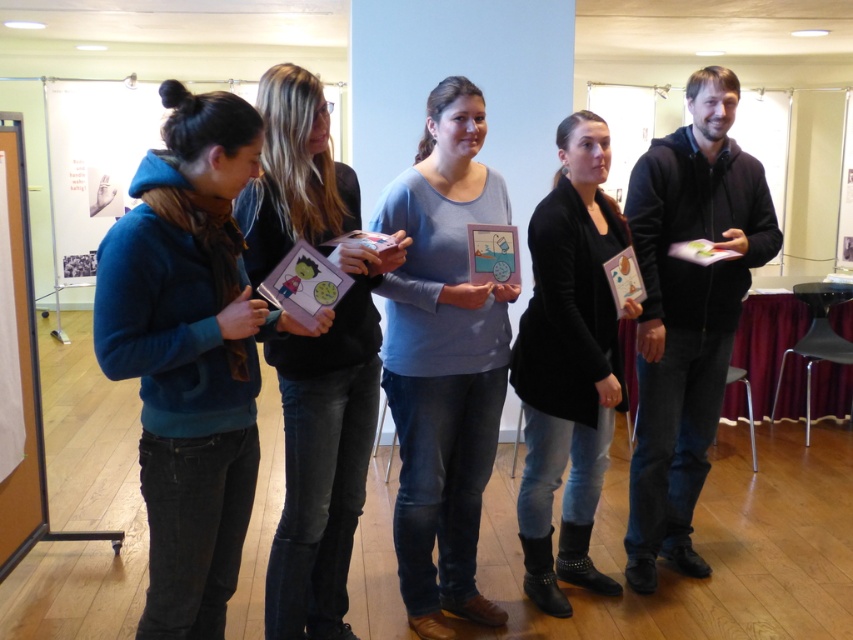
This screenshot has width=853, height=640. What do you see at coordinates (325, 454) in the screenshot? I see `matte black card at center` at bounding box center [325, 454].

Who is lower down, matte black card at center or black leather jacket at center?

black leather jacket at center is below.

Locate an element on the screen. matte black card at center is located at coordinates (325, 454).

Can you confirm if teal fleece jacket at left is positioned to the left of black leather jacket at center?

Correct, you'll find teal fleece jacket at left to the left of black leather jacket at center.

From the picture: Can you confirm if teal fleece jacket at left is smaller than black leather jacket at center?

Yes.

Who is more distant from viewer, (131,268) or (553,180)?

The point (553,180) is behind.

What are the coordinates of `teal fleece jacket at left` in the screenshot? It's located at (189, 355).

Is light blue sweater at center thinner than black leather jacket at center?

No, light blue sweater at center is not thinner than black leather jacket at center.

Based on the photo, is light blue sweater at center positioned in front of black leather jacket at center?

Yes, light blue sweater at center is in front of black leather jacket at center.

What do you see at coordinates (444, 358) in the screenshot?
I see `light blue sweater at center` at bounding box center [444, 358].

Locate an element on the screen. The image size is (853, 640). light blue sweater at center is located at coordinates (444, 358).